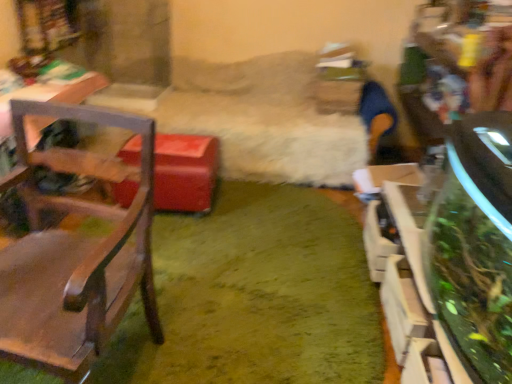
Question: Are wooden chair at left and green leafy plant at right far apart?

Choices:
 (A) no
 (B) yes

Answer: (B)

Question: Is wooden chair at left located outside green leafy plant at right?

Choices:
 (A) no
 (B) yes

Answer: (B)

Question: Is wooden chair at left aimed at green leafy plant at right?

Choices:
 (A) yes
 (B) no

Answer: (B)

Question: Is wooden chair at left to the right of green leafy plant at right from the viewer's perspective?

Choices:
 (A) no
 (B) yes

Answer: (A)

Question: Is wooden chair at left turned away from green leafy plant at right?

Choices:
 (A) yes
 (B) no

Answer: (B)

Question: From the image's perspective, relative to green plush carpet at center, is green leafy plant at right above or below?

Choices:
 (A) above
 (B) below

Answer: (B)

Question: Considering the positions of point (457, 312) and point (307, 205), is point (457, 312) closer or farther from the camera than point (307, 205)?

Choices:
 (A) closer
 (B) farther

Answer: (A)

Question: In the image, is green leafy plant at right on the left side or the right side of green plush carpet at center?

Choices:
 (A) right
 (B) left

Answer: (A)

Question: Looking at their shapes, would you say green leafy plant at right is wider or thinner than green plush carpet at center?

Choices:
 (A) wide
 (B) thin

Answer: (B)

Question: Is point (121, 360) closer or farther from the camera than point (475, 233)?

Choices:
 (A) farther
 (B) closer

Answer: (B)

Question: Choose the correct answer: Is green plush carpet at center inside green leafy plant at right or outside it?

Choices:
 (A) inside
 (B) outside

Answer: (B)

Question: Considering the positions of green plush carpet at center and green leafy plant at right in the image, is green plush carpet at center wider or thinner than green leafy plant at right?

Choices:
 (A) thin
 (B) wide

Answer: (B)

Question: Based on their sizes in the image, would you say green plush carpet at center is bigger or smaller than green leafy plant at right?

Choices:
 (A) small
 (B) big

Answer: (A)

Question: In terms of height, does green leafy plant at right look taller or shorter compared to wooden chair at left?

Choices:
 (A) tall
 (B) short

Answer: (B)

Question: From a real-world perspective, is green leafy plant at right positioned above or below wooden chair at left?

Choices:
 (A) above
 (B) below

Answer: (B)